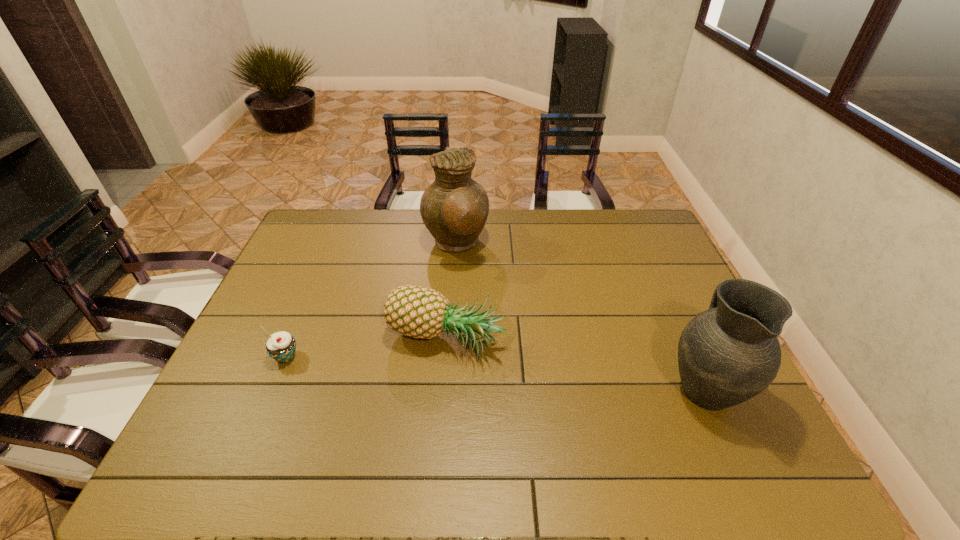
Where is `free space between the third tallest object and the right pitcher`? free space between the third tallest object and the right pitcher is located at coordinates (575, 365).

Identify which object is the closest to the right pitcher. Please provide its 2D coordinates. Your answer should be formatted as a tuple, i.e. [(x, y)], where the tuple contains the x and y coordinates of a point satisfying the conditions above.

[(414, 311)]

The width and height of the screenshot is (960, 540). I want to click on object identified as the third closest to the pineapple, so click(728, 354).

Find the location of a particular element. Image resolution: width=960 pixels, height=540 pixels. free space that satisfies the following two spatial constraints: 1. at the spout of the farthest object; 2. on the front side of the shortest object is located at coordinates (448, 357).

Identify the location of vacant region that satisfies the following two spatial constraints: 1. at the spout of the farther pitcher; 2. on the side of the right pitcher with the handle. This screenshot has width=960, height=540. (445, 388).

This screenshot has height=540, width=960. I want to click on blank area in the image that satisfies the following two spatial constraints: 1. at the spout of the left pitcher; 2. on the front side of the second shortest object, so click(x=449, y=342).

You are a GUI agent. You are given a task and a screenshot of the screen. Output one action in this format:
    pyautogui.click(x=<x>, y=<y>)
    Task: Click on the blank area in the image that satisfies the following two spatial constraints: 1. on the side of the rightmost object with the handle; 2. at the spout of the farthest object
    This screenshot has height=540, width=960.
    Given the screenshot: What is the action you would take?
    pyautogui.click(x=639, y=244)

This screenshot has height=540, width=960. I want to click on free space that satisfies the following two spatial constraints: 1. on the side of the right pitcher with the handle; 2. at the spout of the farthest object, so click(x=639, y=244).

Identify the location of blank space that satisfies the following two spatial constraints: 1. on the side of the right pitcher with the handle; 2. at the spout of the farther pitcher. The height and width of the screenshot is (540, 960). pyautogui.click(x=639, y=244).

The height and width of the screenshot is (540, 960). What are the coordinates of `vacant area that satisfies the following two spatial constraints: 1. at the spout of the left pitcher; 2. on the front side of the pineapple` in the screenshot? It's located at (449, 342).